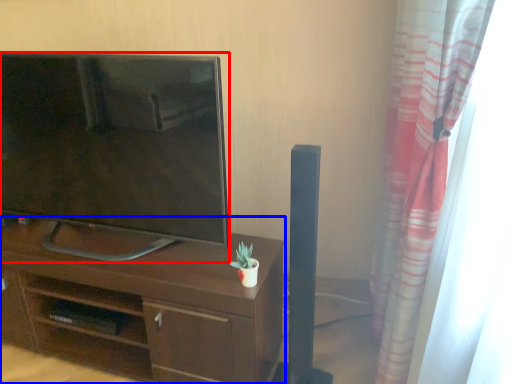
Question: Which object is further to the camera taking this photo, television (highlighted by a red box) or desk (highlighted by a blue box)?

Choices:
 (A) television
 (B) desk

Answer: (B)